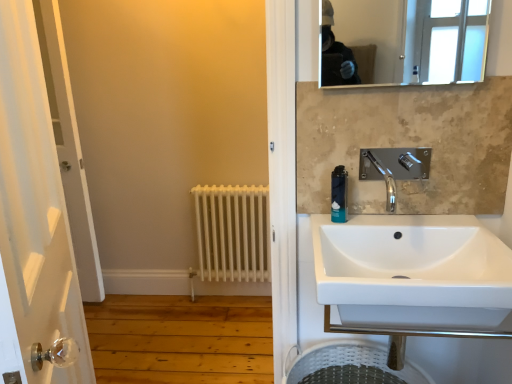
The image size is (512, 384). I want to click on white matte radiator at lower left, so 232,232.

Where is `white plastic laundry basket at lower right`? The image size is (512, 384). white plastic laundry basket at lower right is located at coordinates (351, 365).

You are a GUI agent. You are given a task and a screenshot of the screen. Output one action in this format:
    pyautogui.click(x=<x>, y=<y>)
    Task: Click on the white matte radiator at lower left
    The width and height of the screenshot is (512, 384).
    Given the screenshot: What is the action you would take?
    pyautogui.click(x=232, y=232)

Is white matte radiator at lower left aimed at black plastic soap dispenser at upper right?

Yes.

Would you say white matte radiator at lower left is outside black plastic soap dispenser at upper right?

Absolutely, white matte radiator at lower left is external to black plastic soap dispenser at upper right.

Would you say white matte radiator at lower left is to the left or to the right of black plastic soap dispenser at upper right in the picture?

Clearly, white matte radiator at lower left is on the left of black plastic soap dispenser at upper right in the image.

Considering the positions of objects black plastic soap dispenser at upper right and clear glass mirror at upper center in the image provided, who is more to the right, black plastic soap dispenser at upper right or clear glass mirror at upper center?

Positioned to the right is clear glass mirror at upper center.

From the image's perspective, is black plastic soap dispenser at upper right located above or below clear glass mirror at upper center?

From the image's perspective, black plastic soap dispenser at upper right appears below clear glass mirror at upper center.

How distant is black plastic soap dispenser at upper right from clear glass mirror at upper center?

black plastic soap dispenser at upper right is 6.12 feet from clear glass mirror at upper center.

Is black plastic soap dispenser at upper right directly adjacent to clear glass mirror at upper center?

There is a gap between black plastic soap dispenser at upper right and clear glass mirror at upper center.

Is point (383, 357) less distant than point (390, 228)?

No, (383, 357) is further to viewer.

Locate an element on the screen. The height and width of the screenshot is (384, 512). laundry basket on the left side of white ceramic sink at center is located at coordinates (351, 365).

From a real-world perspective, is white plastic laundry basket at lower right below white ceramic sink at center?

Correct, in the physical world, white plastic laundry basket at lower right is lower than white ceramic sink at center.

Can you tell me how much white plastic laundry basket at lower right and white ceramic sink at center differ in facing direction?

There is a 0.58-degree angle between the facing directions of white plastic laundry basket at lower right and white ceramic sink at center.

From a real-world perspective, is white plastic laundry basket at lower right on top of clear glass mirror at upper center?

Actually, white plastic laundry basket at lower right is physically below clear glass mirror at upper center in the real world.

Considering the relative sizes of white plastic laundry basket at lower right and clear glass mirror at upper center in the image provided, is white plastic laundry basket at lower right wider than clear glass mirror at upper center?

Yes, white plastic laundry basket at lower right is wider than clear glass mirror at upper center.

How different are the orientations of white plastic laundry basket at lower right and clear glass mirror at upper center in degrees?

There is a 0.243-degree angle between the facing directions of white plastic laundry basket at lower right and clear glass mirror at upper center.

Does white plastic laundry basket at lower right come in front of clear glass mirror at upper center?

No, white plastic laundry basket at lower right is further to the viewer.

How different are the orientations of white ceramic sink at center and black plastic soap dispenser at upper right in degrees?

They differ by 0.0411 degrees in their facing directions.

The height and width of the screenshot is (384, 512). In order to click on soap dispenser above the white ceramic sink at center (from the image's perspective) in this screenshot , I will do tap(339, 194).

Is white ceramic sink at center not near black plastic soap dispenser at upper right?

That's not correct — white ceramic sink at center is a little close to black plastic soap dispenser at upper right.

Between white ceramic sink at center and black plastic soap dispenser at upper right, which one appears on the right side from the viewer's perspective?

From the viewer's perspective, white ceramic sink at center appears more on the right side.

Which object is positioned more to the right, white plastic laundry basket at lower right or white glossy door at left?

white plastic laundry basket at lower right is more to the right.

Is white plastic laundry basket at lower right oriented towards white glossy door at left?

No, white plastic laundry basket at lower right does not turn towards white glossy door at left.

This screenshot has height=384, width=512. Find the location of `laundry basket below the white glossy door at left (from the image's perspective)`. laundry basket below the white glossy door at left (from the image's perspective) is located at coordinates (351, 365).

Based on the photo, which of these two, white plastic laundry basket at lower right or white glossy door at left, is wider?

white plastic laundry basket at lower right is wider.

From a real-world perspective, does white ceramic sink at center sit lower than white glossy door at left?

Indeed, from a real-world perspective, white ceramic sink at center is positioned beneath white glossy door at left.

From the picture: Does white ceramic sink at center have a smaller size compared to white glossy door at left?

Yes, white ceramic sink at center is smaller than white glossy door at left.

From the image's perspective, between white ceramic sink at center and white glossy door at left, who is located below?

From the image's view, white ceramic sink at center is below.

Where is `soap dispenser in front of the white matte radiator at lower left`? The image size is (512, 384). soap dispenser in front of the white matte radiator at lower left is located at coordinates (339, 194).

The height and width of the screenshot is (384, 512). Identify the location of mirror lying above the black plastic soap dispenser at upper right (from the image's perspective). (410, 39).

Based on their spatial positions, is white matte radiator at lower left or white ceramic sink at center further from white glossy door at left?

white matte radiator at lower left lies further to white glossy door at left than the other object.

From the picture: From the image, which object appears to be farther from white ceramic sink at center, white matte radiator at lower left or clear glass mirror at upper center?

The object further to white ceramic sink at center is clear glass mirror at upper center.

Considering their positions, is white glossy door at left positioned closer to black plastic soap dispenser at upper right than white plastic laundry basket at lower right?

The object closer to black plastic soap dispenser at upper right is white plastic laundry basket at lower right.

From the image, which object appears to be farther from white plastic laundry basket at lower right, black plastic soap dispenser at upper right or white matte radiator at lower left?

white matte radiator at lower left lies further to white plastic laundry basket at lower right than the other object.

Looking at the image, which one is located further to white glossy door at left, black plastic soap dispenser at upper right or chrome metallic faucet at upper right?

Among the two, chrome metallic faucet at upper right is located further to white glossy door at left.

Estimate the real-world distances between objects in this image. Which object is closer to white plastic laundry basket at lower right, white matte radiator at lower left or white ceramic sink at center?

Among the two, white ceramic sink at center is located nearer to white plastic laundry basket at lower right.

From the image, which object appears to be nearer to white matte radiator at lower left, chrome metallic faucet at upper right or clear glass mirror at upper center?

chrome metallic faucet at upper right is positioned closer to the anchor white matte radiator at lower left.

Based on their spatial positions, is white ceramic sink at center or chrome metallic faucet at upper right closer to white plastic laundry basket at lower right?

white ceramic sink at center is closer to white plastic laundry basket at lower right.

I want to click on soap dispenser between white glossy door at left and white matte radiator at lower left along the z-axis, so click(339, 194).

You are a GUI agent. You are given a task and a screenshot of the screen. Output one action in this format:
    pyautogui.click(x=<x>, y=<y>)
    Task: Click on the soap dispenser between chrome metallic faucet at upper right and white ceramic sink at center in the up-down direction
    This screenshot has width=512, height=384.
    Given the screenshot: What is the action you would take?
    pyautogui.click(x=339, y=194)

Locate an element on the screen. The image size is (512, 384). tap between clear glass mirror at upper center and white plastic laundry basket at lower right in the vertical direction is located at coordinates (394, 168).

The height and width of the screenshot is (384, 512). Find the location of `soap dispenser between white glossy door at left and white ceramic sink at center`. soap dispenser between white glossy door at left and white ceramic sink at center is located at coordinates (339, 194).